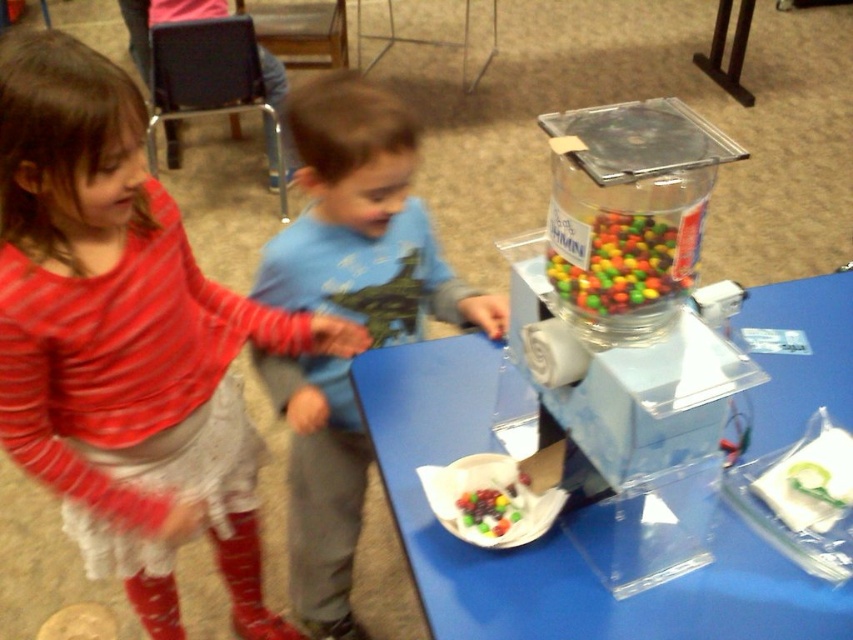
Is point (68, 284) farther from camera compared to point (497, 515)?

No, it is in front of (497, 515).

Can you confirm if striped cotton shirt at upper left is smaller than shiny multicolored candies at center?

Incorrect, striped cotton shirt at upper left is not smaller in size than shiny multicolored candies at center.

The width and height of the screenshot is (853, 640). Find the location of `striped cotton shirt at upper left`. striped cotton shirt at upper left is located at coordinates (125, 340).

Does point (39, 289) lie in front of point (688, 289)?

No, (39, 289) is further to viewer.

Is striped cotton shirt at upper left to the left of multicolored glossy candy at center from the viewer's perspective?

Indeed, striped cotton shirt at upper left is positioned on the left side of multicolored glossy candy at center.

Does point (157, 234) come closer to viewer compared to point (596, 289)?

No, it is behind (596, 289).

The image size is (853, 640). In order to click on striped cotton shirt at upper left in this screenshot , I will do `click(125, 340)`.

From the picture: Does multicolored glossy candy at center have a greater width compared to shiny multicolored candies at center?

Yes, multicolored glossy candy at center is wider than shiny multicolored candies at center.

Can you confirm if multicolored glossy candy at center is positioned above shiny multicolored candies at center?

Correct, multicolored glossy candy at center is located above shiny multicolored candies at center.

This screenshot has width=853, height=640. Identify the location of multicolored glossy candy at center. (619, 259).